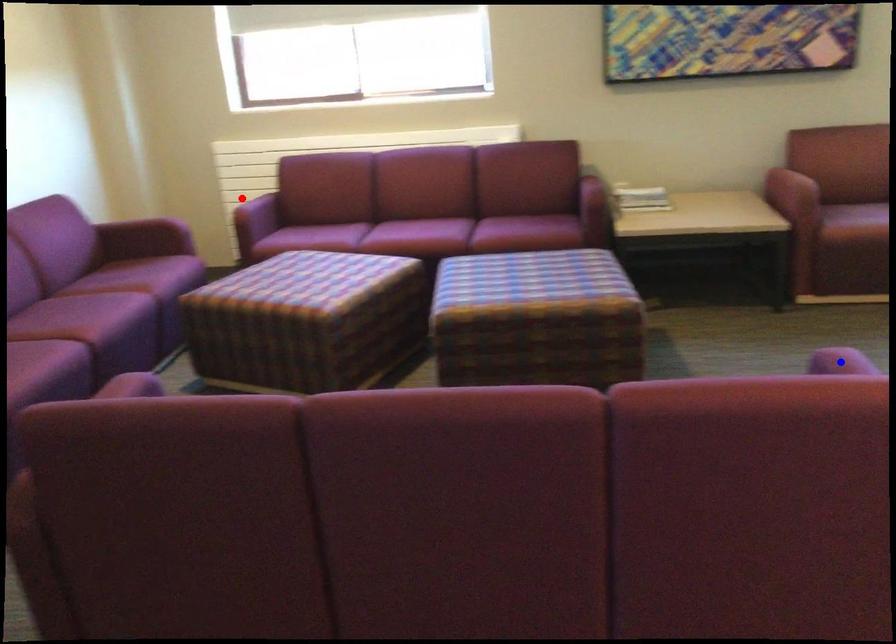
Question: In the image, two points are highlighted. Which point is nearer to the camera? Reply with the corresponding letter.

Choices:
 (A) blue point
 (B) red point

Answer: (A)